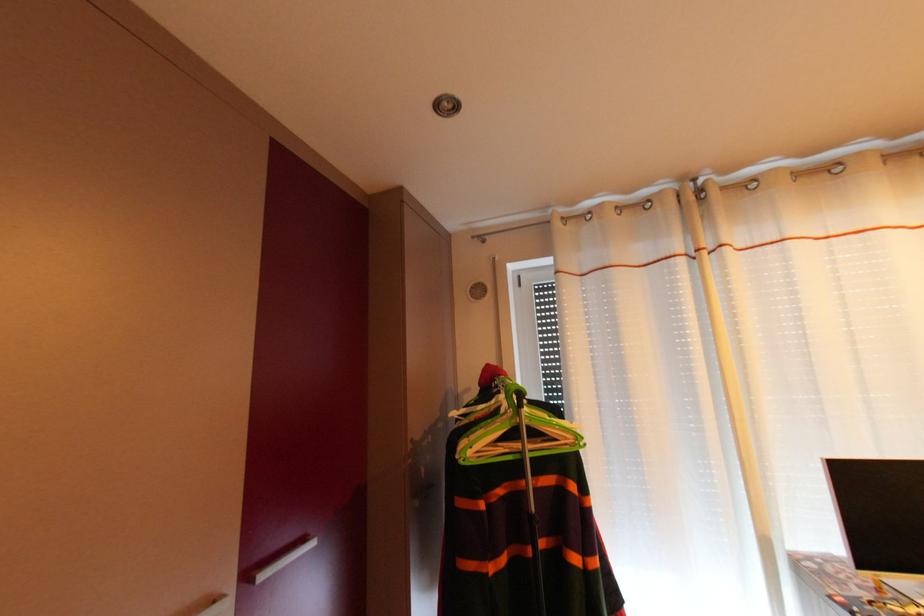
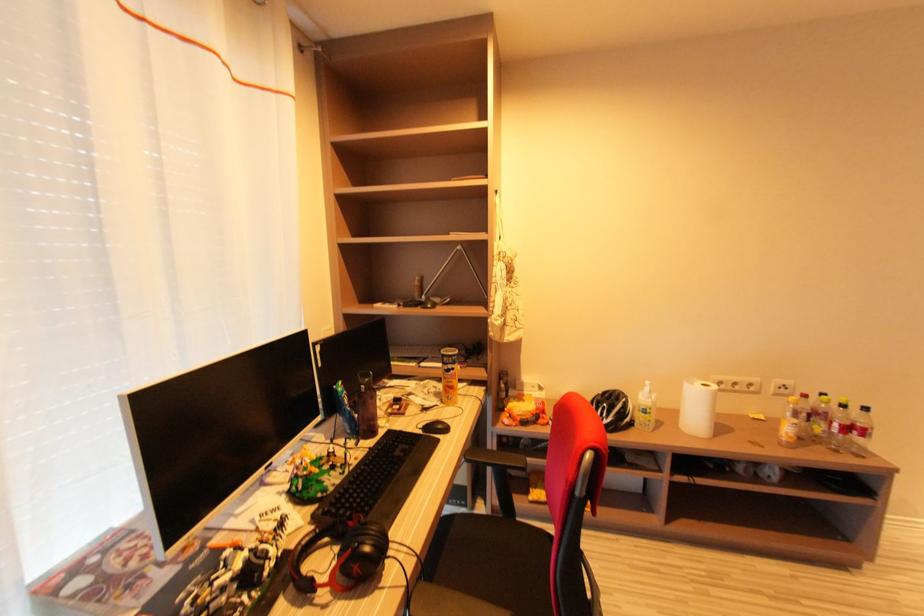
Question: The camera is either moving clockwise (left) or counter-clockwise (right) around the object. The first image is from the beginning of the video and the second image is from the end. Is the camera moving left or right when shooting the video?

Choices:
 (A) Left
 (B) Right

Answer: (A)